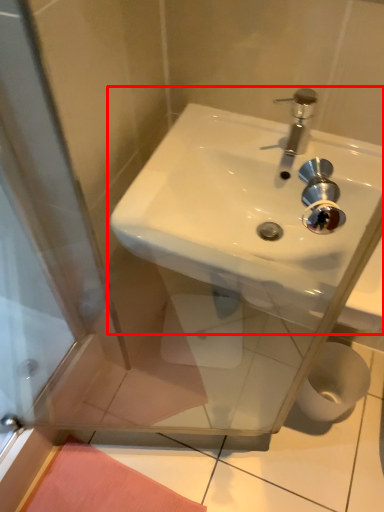
Question: From the image's perspective, considering the relative positions of sink (annotated by the red box) and toilet paper in the image provided, where is sink (annotated by the red box) located with respect to the staircase?

Choices:
 (A) above
 (B) below

Answer: (A)